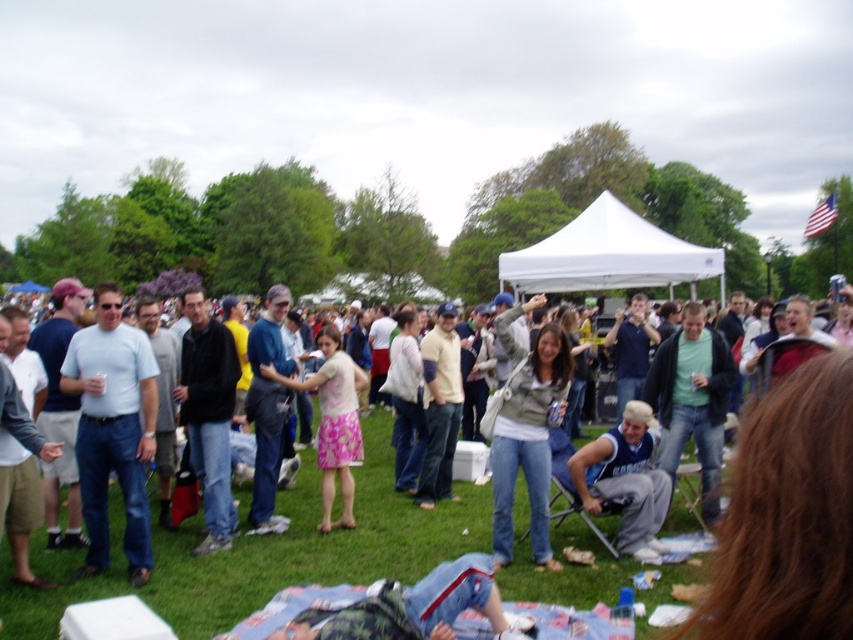
Question: Can you confirm if denim skirt at center is positioned above denim jacket at center?

Choices:
 (A) yes
 (B) no

Answer: (B)

Question: Which point appears farthest from the camera in this image?

Choices:
 (A) (660, 410)
 (B) (323, 388)

Answer: (A)

Question: Is green matte shirt at center smaller than pink floral dress at center?

Choices:
 (A) yes
 (B) no

Answer: (B)

Question: Which of these objects is positioned closest to the green grass at center?

Choices:
 (A) denim jacket at center
 (B) pink floral dress at center
 (C) white fabric canopy at center
 (D) gray fabric jacket at center

Answer: (B)

Question: Observing the image, what is the correct spatial positioning of green grass at center in reference to gray fabric jacket at center?

Choices:
 (A) right
 (B) left

Answer: (B)

Question: Which of the following is the closest to the observer?

Choices:
 (A) (421, 500)
 (B) (120, 458)
 (C) (662, 499)

Answer: (B)